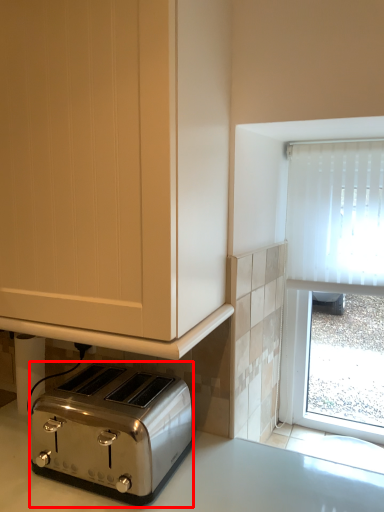
Question: Observing the image, what is the correct spatial positioning of toaster (annotated by the red box) in reference to cabinetry?

Choices:
 (A) left
 (B) right

Answer: (B)